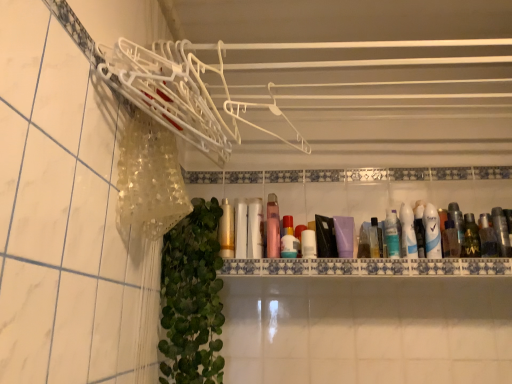
Question: From a real-world perspective, relative to gold metallic mouthwash at center, the first mouthwash when ordered from left to right, is white glossy tube at right, which is the 5th mouthwash in right-to-left order, vertically above or below?

Choices:
 (A) below
 (B) above

Answer: (B)

Question: Based on their sizes in the image, would you say white glossy tube at right, which is counted as the 7th mouthwash, starting from the left, is bigger or smaller than gold metallic mouthwash at center, the first mouthwash when ordered from left to right?

Choices:
 (A) big
 (B) small

Answer: (B)

Question: Which object is positioned farthest from the white matte tube at center, which is the tenth mouthwash in right-to-left order?

Choices:
 (A) pink glossy bottle at center, the 4th mouthwash in the left-to-right sequence
 (B) translucent plastic mouthwash at right, arranged as the 4th mouthwash when viewed from the right
 (C) translucent plastic bottle at center, which ranks as the fifth mouthwash in left-to-right order
 (D) white matte shaving cream at right
 (E) blue glossy deodorant at right, acting as the second toiletry starting from the left

Answer: (B)

Question: Which of these objects is positioned farthest from the green leafy plant at lower left?

Choices:
 (A) white matte tube at center, the third mouthwash when ordered from left to right
 (B) clear plastic bottle at right, which is the 10th mouthwash from left to right
 (C) green matte bottle at right, which is the third mouthwash in right-to-left order
 (D) blue glossy mouthwash at right, placed as the sixth mouthwash when sorted from left to right
 (E) white matte shaving cream at right

Answer: (B)